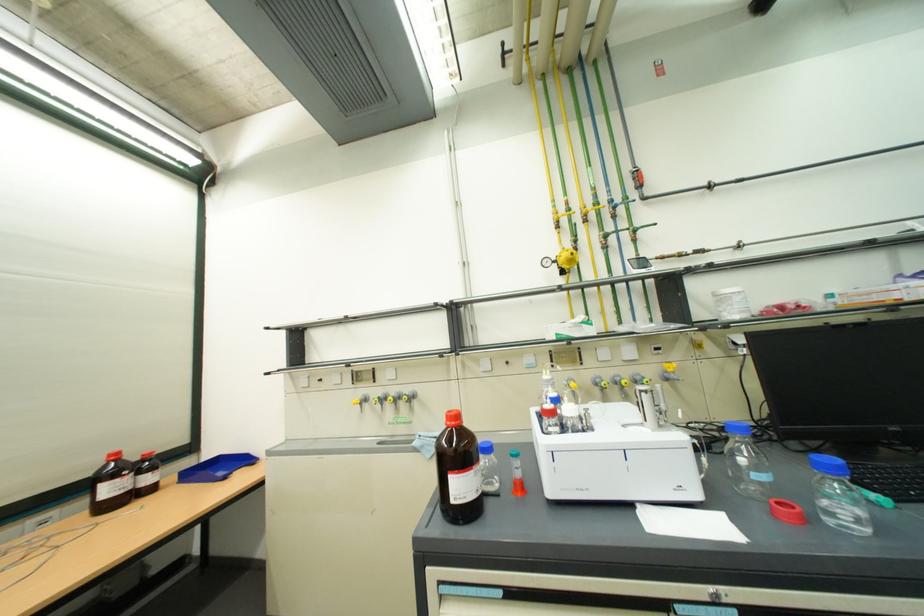
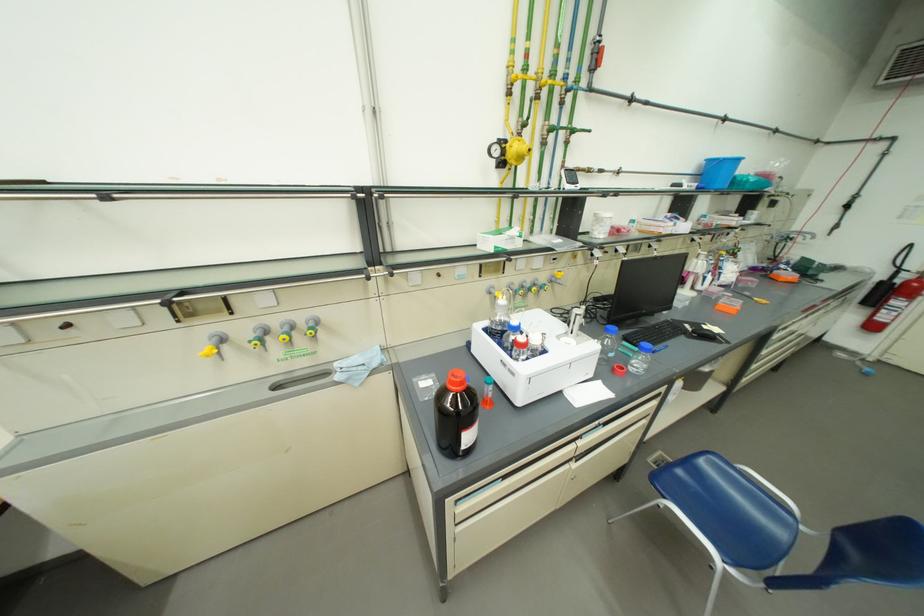
Where in the second image is the point corresponding to (x=837, y=508) from the first image?

(642, 365)